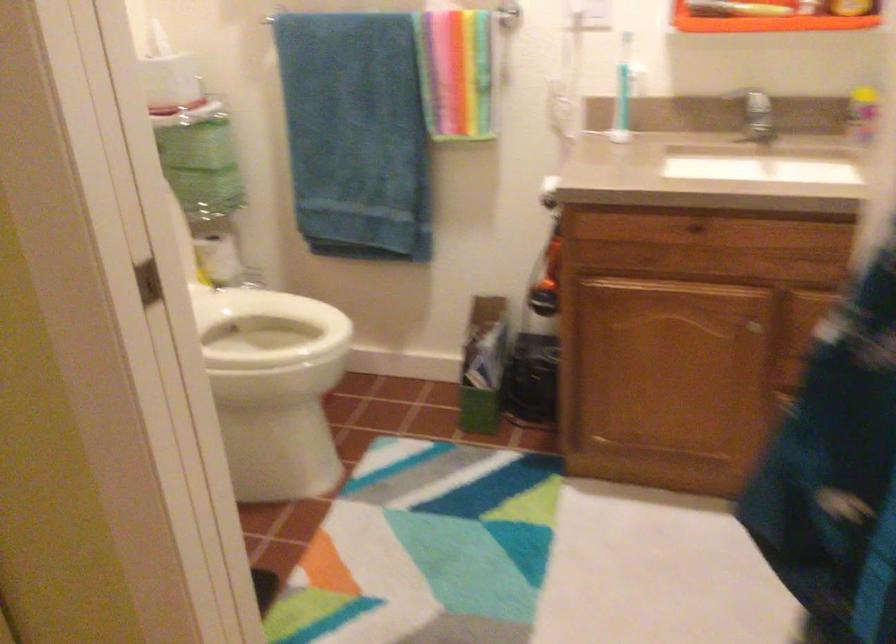
Where is `cabinet door knob`? cabinet door knob is located at coordinates (692, 229).